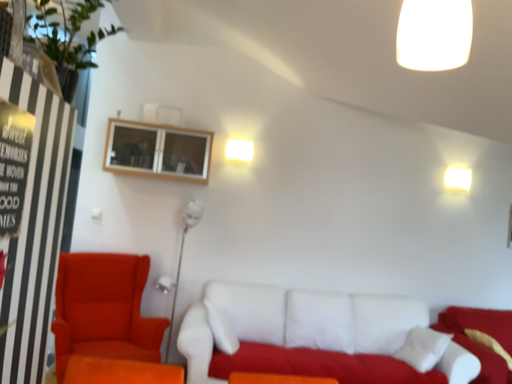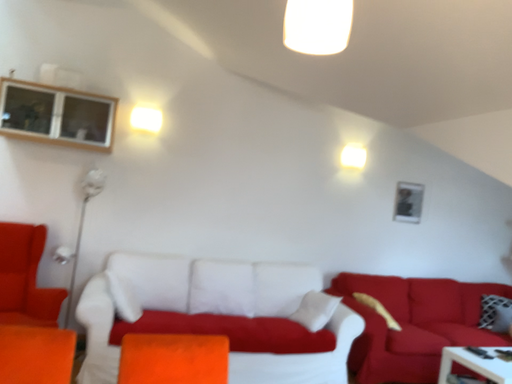
Question: Which way did the camera rotate in the video?

Choices:
 (A) rotated left
 (B) rotated right

Answer: (B)